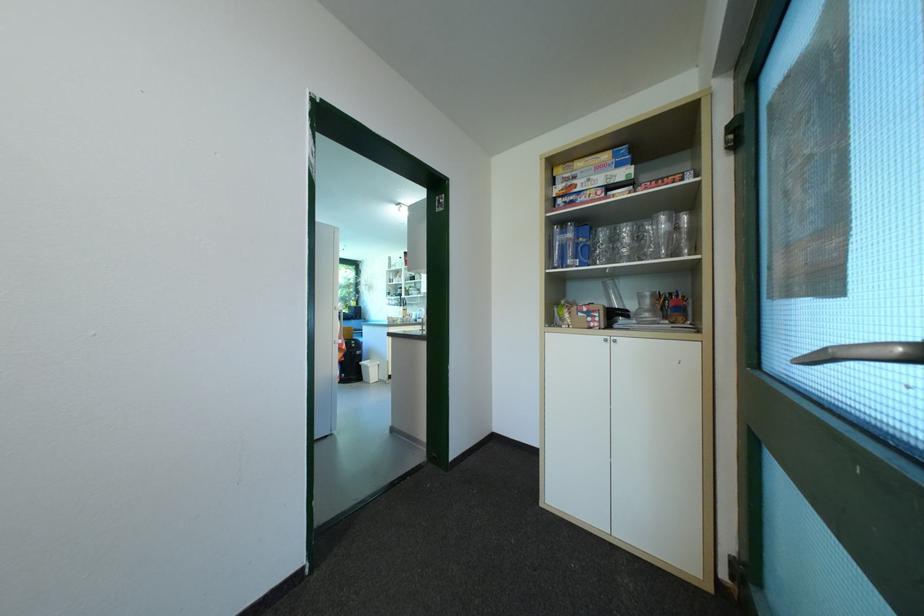
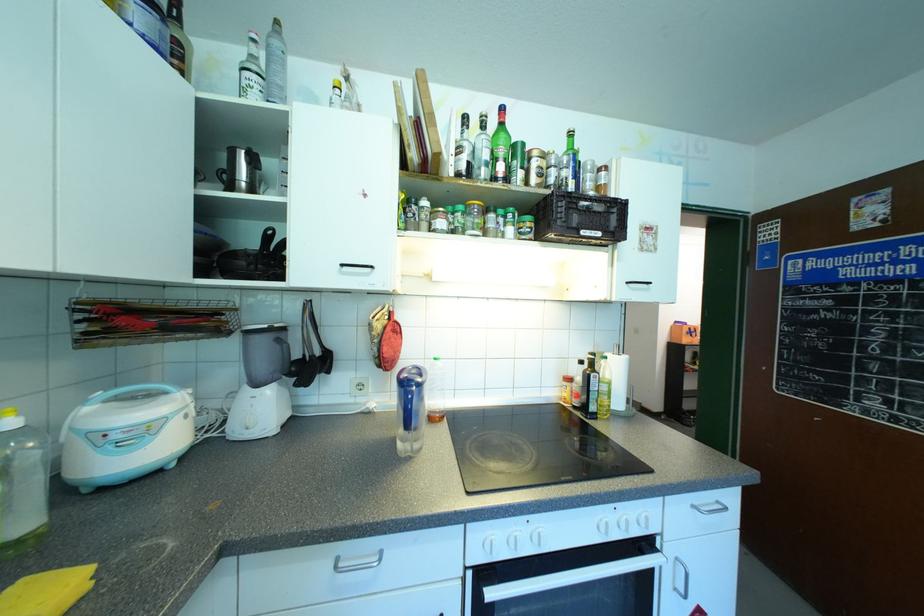
Question: I am providing you with two images of the same scene from different viewpoints. After the viewpoint changes to image2, which objects are now occluded?

Choices:
 (A) glass mug
 (B) metal kettle
 (C) small spice jar
 (D) olive oil bottle

Answer: (A)